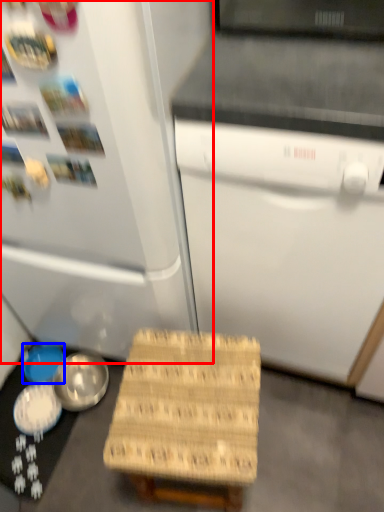
Question: Which object appears closest to the camera in this image, refrigerator (highlighted by a red box) or bowl (highlighted by a blue box)?

Choices:
 (A) refrigerator
 (B) bowl

Answer: (A)